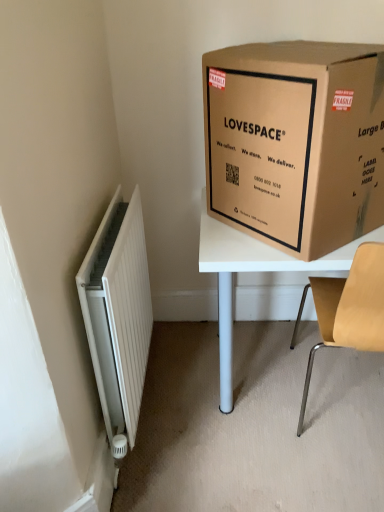
Question: Is light brown wood chair at right smaller than brown cardboard box at upper right?

Choices:
 (A) yes
 (B) no

Answer: (B)

Question: Does light brown wood chair at right have a greater height compared to brown cardboard box at upper right?

Choices:
 (A) yes
 (B) no

Answer: (A)

Question: Considering the relative positions of light brown wood chair at right and brown cardboard box at upper right in the image provided, is light brown wood chair at right behind brown cardboard box at upper right?

Choices:
 (A) yes
 (B) no

Answer: (A)

Question: Would you consider light brown wood chair at right to be distant from brown cardboard box at upper right?

Choices:
 (A) yes
 (B) no

Answer: (B)

Question: Is light brown wood chair at right wider than brown cardboard box at upper right?

Choices:
 (A) yes
 (B) no

Answer: (A)

Question: Is white ribbed radiator at left wider or thinner than brown cardboard box at upper right?

Choices:
 (A) thin
 (B) wide

Answer: (A)

Question: Considering the positions of point (79, 283) and point (208, 86), is point (79, 283) closer or farther from the camera than point (208, 86)?

Choices:
 (A) farther
 (B) closer

Answer: (B)

Question: From the image's perspective, is white ribbed radiator at left located above or below brown cardboard box at upper right?

Choices:
 (A) below
 (B) above

Answer: (A)

Question: From a real-world perspective, is white ribbed radiator at left positioned above or below brown cardboard box at upper right?

Choices:
 (A) below
 (B) above

Answer: (A)

Question: Looking at their shapes, would you say brown cardboard box at upper right is wider or thinner than light brown wood chair at right?

Choices:
 (A) thin
 (B) wide

Answer: (A)

Question: From the image's perspective, is brown cardboard box at upper right located above or below light brown wood chair at right?

Choices:
 (A) above
 (B) below

Answer: (A)

Question: Is brown cardboard box at upper right taller or shorter than light brown wood chair at right?

Choices:
 (A) short
 (B) tall

Answer: (A)

Question: Which is correct: brown cardboard box at upper right is inside light brown wood chair at right, or outside of it?

Choices:
 (A) inside
 (B) outside

Answer: (B)

Question: Considering their positions, is light brown wood chair at right located in front of or behind white ribbed radiator at left?

Choices:
 (A) front
 (B) behind

Answer: (A)

Question: Is light brown wood chair at right inside the boundaries of white ribbed radiator at left, or outside?

Choices:
 (A) outside
 (B) inside

Answer: (A)